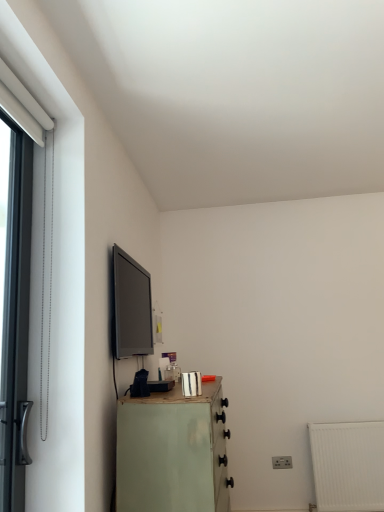
Question: From the image's perspective, is metallic silver canister at lower center located above black metal door at left?

Choices:
 (A) yes
 (B) no

Answer: (B)

Question: Is metallic silver canister at lower center facing towards black metal door at left?

Choices:
 (A) yes
 (B) no

Answer: (B)

Question: Are metallic silver canister at lower center and black metal door at left making contact?

Choices:
 (A) yes
 (B) no

Answer: (B)

Question: From the image's perspective, is metallic silver canister at lower center below black metal door at left?

Choices:
 (A) yes
 (B) no

Answer: (A)

Question: Does metallic silver canister at lower center appear on the left side of black metal door at left?

Choices:
 (A) yes
 (B) no

Answer: (B)

Question: From a real-world perspective, is metallic silver canister at lower center physically located above or below light green painted wood chest of drawers at lower left?

Choices:
 (A) above
 (B) below

Answer: (A)

Question: Based on their sizes in the image, would you say metallic silver canister at lower center is bigger or smaller than light green painted wood chest of drawers at lower left?

Choices:
 (A) big
 (B) small

Answer: (B)

Question: Considering the positions of metallic silver canister at lower center and light green painted wood chest of drawers at lower left in the image, is metallic silver canister at lower center taller or shorter than light green painted wood chest of drawers at lower left?

Choices:
 (A) tall
 (B) short

Answer: (B)

Question: Considering the positions of metallic silver canister at lower center and light green painted wood chest of drawers at lower left in the image, is metallic silver canister at lower center wider or thinner than light green painted wood chest of drawers at lower left?

Choices:
 (A) thin
 (B) wide

Answer: (A)

Question: From the image's perspective, is matte black tv at upper left above or below black metal door at left?

Choices:
 (A) below
 (B) above

Answer: (A)

Question: Is matte black tv at upper left inside or outside of black metal door at left?

Choices:
 (A) outside
 (B) inside

Answer: (A)

Question: In the image, is matte black tv at upper left positioned in front of or behind black metal door at left?

Choices:
 (A) behind
 (B) front

Answer: (A)

Question: Is point (115, 268) closer or farther from the camera than point (1, 264)?

Choices:
 (A) farther
 (B) closer

Answer: (A)

Question: From a real-world perspective, relative to black metal door at left, is metallic silver canister at lower center vertically above or below?

Choices:
 (A) above
 (B) below

Answer: (B)

Question: From the image's perspective, relative to black metal door at left, is metallic silver canister at lower center above or below?

Choices:
 (A) above
 (B) below

Answer: (B)